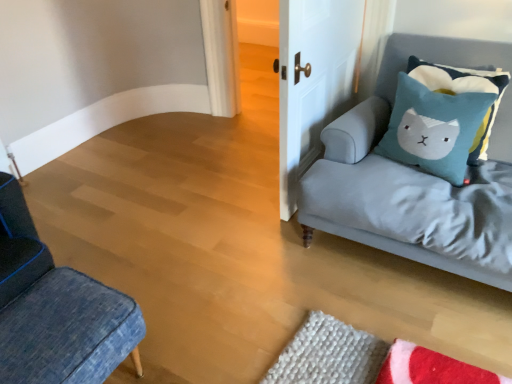
Locate an element on the screen. free space to the left of light gray fabric couch at right is located at coordinates (229, 240).